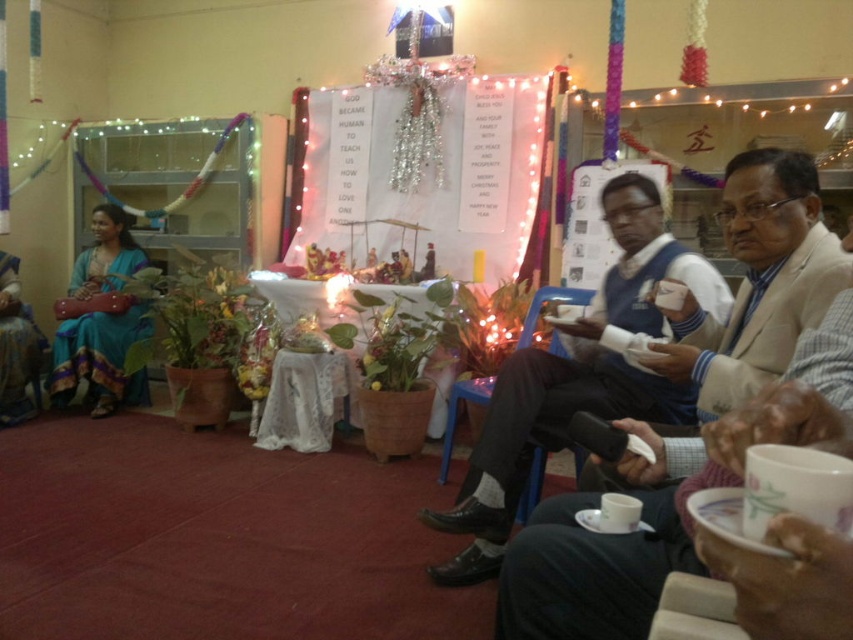
In the scene shown: Does white plastic chair at lower right have a greater height compared to blue plastic chair at center?

No.

Which is above, white plastic chair at lower right or blue plastic chair at center?

Positioned higher is blue plastic chair at center.

Measure the distance between point (674, 618) and camera.

The distance of point (674, 618) from camera is 32.86 inches.

Find the location of a particular element. The width and height of the screenshot is (853, 640). white plastic chair at lower right is located at coordinates (695, 609).

Measure the distance between point (624, 484) and camera.

They are 5.25 feet apart.

Who is positioned more to the left, light beige suit at right or matte blue dress at left?

From the viewer's perspective, matte blue dress at left appears more on the left side.

This screenshot has height=640, width=853. Identify the location of light beige suit at right. (757, 282).

Based on the photo, does matte blue dress at left lie in front of blue plastic chair at center?

That is False.

Does matte blue dress at left appear over blue plastic chair at center?

Yes.

The width and height of the screenshot is (853, 640). I want to click on matte blue dress at left, so click(x=99, y=358).

Find the location of a particular element. matte blue dress at left is located at coordinates (99, 358).